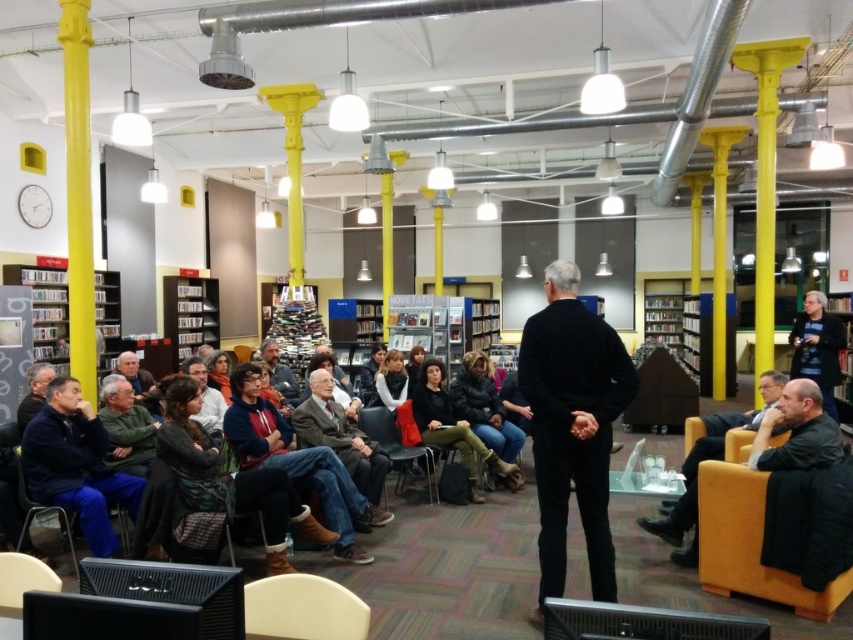
Question: Which of these objects is positioned closest to the orange fabric chair at lower right?

Choices:
 (A) dark blue t-shirt at right
 (B) green sweater at center

Answer: (A)

Question: Is dark blue t-shirt at right thinner than matte black chair at center?

Choices:
 (A) yes
 (B) no

Answer: (A)

Question: Which point is closer to the camera taking this photo?

Choices:
 (A) (20, 458)
 (B) (578, 305)
 (C) (50, 401)
 (D) (314, 577)

Answer: (D)

Question: Which of the following is the farthest from the observer?

Choices:
 (A) dark gray sweater at center
 (B) dark gray sweater at lower right
 (C) dark blue t-shirt at right
 (D) dark gray fabric jacket at center

Answer: (A)

Question: Can you confirm if dark gray fabric jacket at center is smaller than dark blue t-shirt at right?

Choices:
 (A) no
 (B) yes

Answer: (B)

Question: Can you confirm if dark gray fabric jacket at center is positioned to the right of metallic gray chair at lower left?

Choices:
 (A) no
 (B) yes

Answer: (B)